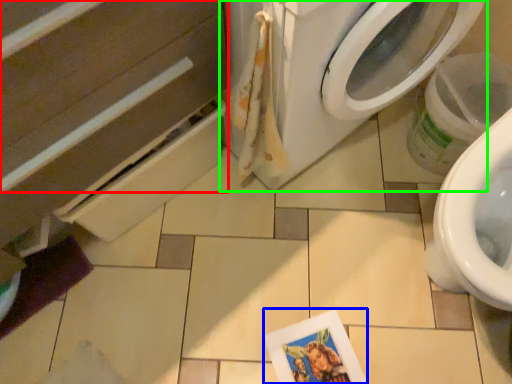
Question: Which object is positioned farthest from drawer (highlighted by a red box)? Select from postcard (highlighted by a blue box) and washing machine (highlighted by a green box).

Choices:
 (A) postcard
 (B) washing machine

Answer: (A)